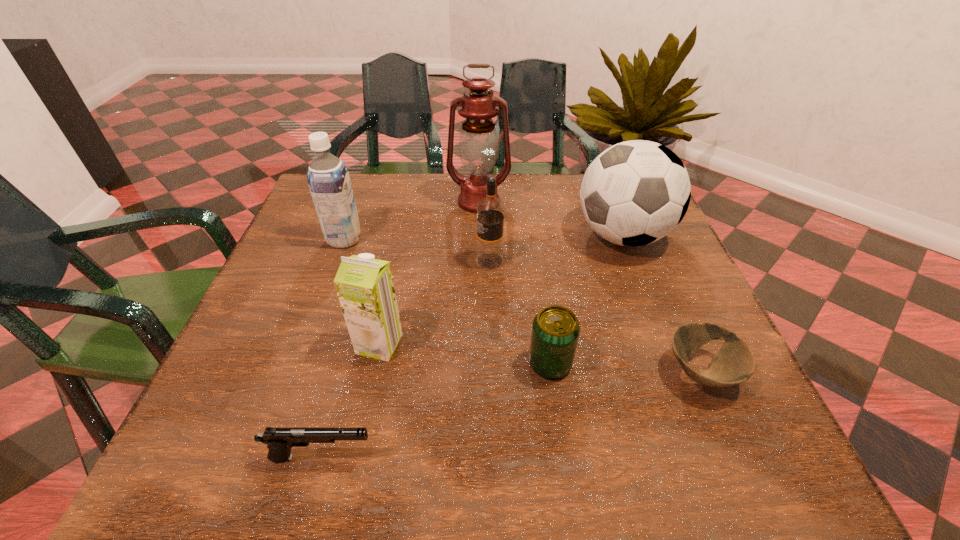
Image resolution: width=960 pixels, height=540 pixels. I want to click on free location that satisfies the following two spatial constraints: 1. on the label of the bowl; 2. on the right side of the left soya milk, so click(296, 373).

Where is `vacant region that satisfies the following two spatial constraints: 1. on the label of the left soya milk; 2. on the left side of the bowl`? The width and height of the screenshot is (960, 540). vacant region that satisfies the following two spatial constraints: 1. on the label of the left soya milk; 2. on the left side of the bowl is located at coordinates (296, 373).

Locate an element on the screen. The image size is (960, 540). vacant space that satisfies the following two spatial constraints: 1. on the back side of the sixth tallest object; 2. on the label of the taller soya milk is located at coordinates (533, 239).

The image size is (960, 540). Find the location of `blank space that satisfies the following two spatial constraints: 1. on the label of the vodka; 2. on the left side of the third object from right to left`. blank space that satisfies the following two spatial constraints: 1. on the label of the vodka; 2. on the left side of the third object from right to left is located at coordinates (492, 363).